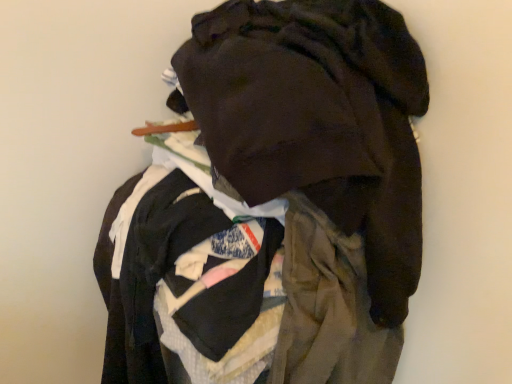
Find the location of a particular element. dark matte jacket at center is located at coordinates (274, 204).

What do you see at coordinates (274, 204) in the screenshot?
I see `dark matte jacket at center` at bounding box center [274, 204].

Locate an element on the screen. The width and height of the screenshot is (512, 384). dark matte jacket at center is located at coordinates (274, 204).